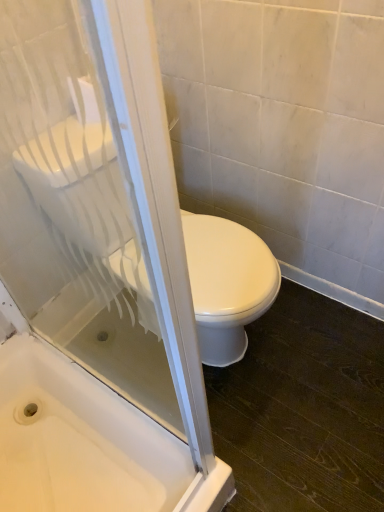
Question: In the image, is white glossy bathtub at lower left on the left side or the right side of transparent glass screen door at upper left?

Choices:
 (A) left
 (B) right

Answer: (A)

Question: Do you think white glossy bathtub at lower left is within transparent glass screen door at upper left, or outside of it?

Choices:
 (A) inside
 (B) outside

Answer: (B)

Question: Which object is the farthest from the white glossy bathtub at lower left?

Choices:
 (A) transparent glass screen door at upper left
 (B) white glossy toilet at center

Answer: (B)

Question: Which object is positioned farthest from the transparent glass screen door at upper left?

Choices:
 (A) white glossy bathtub at lower left
 (B) white glossy toilet at center

Answer: (B)